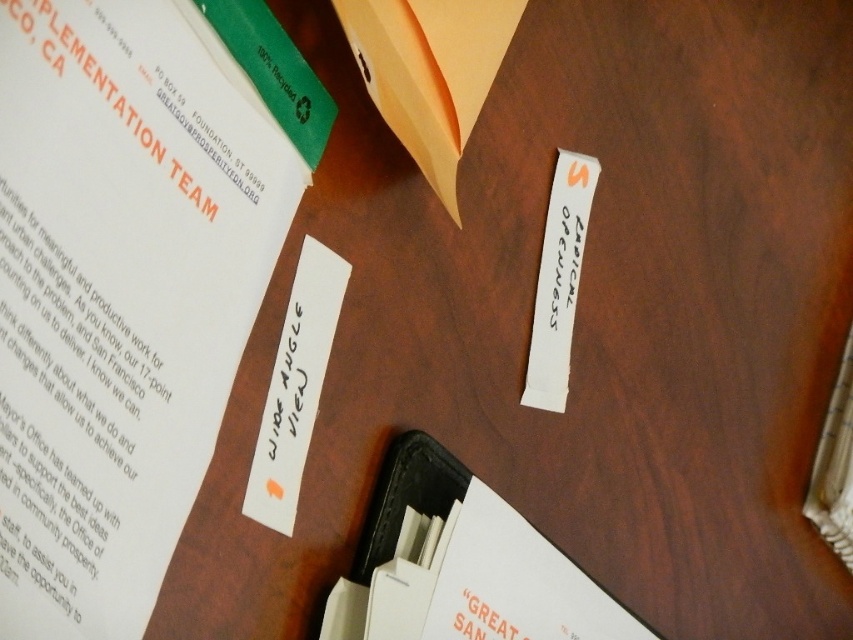
Question: Does black leather binder at lower right have a larger size compared to white matte paper at center?

Choices:
 (A) no
 (B) yes

Answer: (B)

Question: Which point is closer to the camera?

Choices:
 (A) (532, 538)
 (B) (311, 321)
 (C) (169, 317)
 (D) (564, 378)

Answer: (C)

Question: Is white paper at upper left smaller than black leather binder at lower right?

Choices:
 (A) yes
 (B) no

Answer: (A)

Question: Is white paper at upper left to the left of black leather binder at lower right from the viewer's perspective?

Choices:
 (A) no
 (B) yes

Answer: (B)

Question: Which point is farther to the camera?

Choices:
 (A) (x=540, y=275)
 (B) (x=318, y=310)
 (C) (x=117, y=275)

Answer: (A)

Question: Which of the following is the farthest from the observer?

Choices:
 (A) (554, 179)
 (B) (18, 588)
 (C) (320, 285)

Answer: (A)